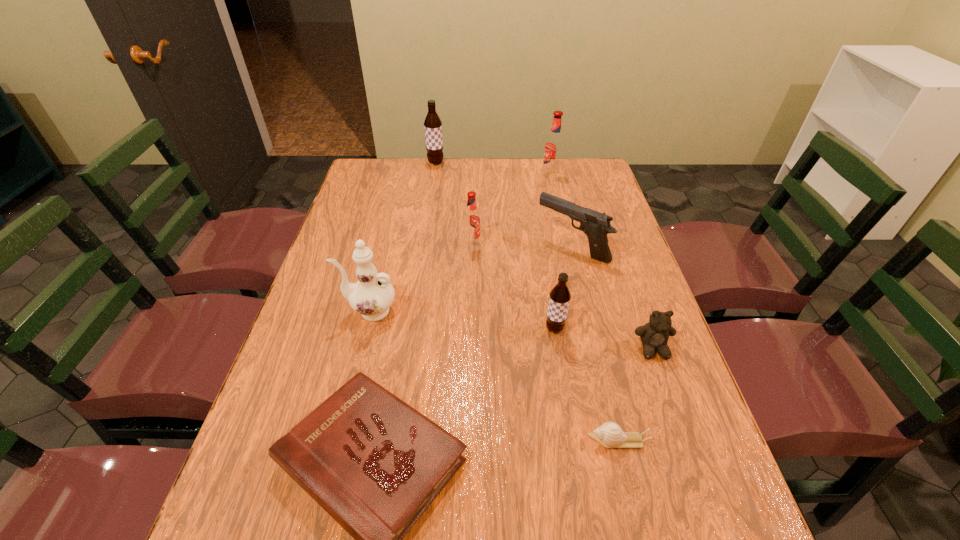
Locate an element on the screen. This screenshot has width=960, height=540. the bigger brown root beer is located at coordinates (433, 126).

At what (x,y) coordinates should I click in order to perform the action: click on the farthest root beer. Please return your answer as a coordinate pair (x, y). The height and width of the screenshot is (540, 960). Looking at the image, I should click on (433, 126).

The height and width of the screenshot is (540, 960). I want to click on the rightmost root beer, so click(554, 145).

This screenshot has width=960, height=540. Identify the location of the right red root beer. (554, 145).

At what (x,y) coordinates should I click in order to perform the action: click on chinaware. Please return your answer as a coordinate pair (x, y). The image size is (960, 540). Looking at the image, I should click on (373, 294).

At what (x,y) coordinates should I click in order to perform the action: click on the nearer red root beer. Please return your answer as a coordinate pair (x, y). Image resolution: width=960 pixels, height=540 pixels. Looking at the image, I should click on (471, 218).

Where is `the third farthest root beer`? the third farthest root beer is located at coordinates tap(471, 218).

This screenshot has height=540, width=960. Find the location of `the smaller brown root beer`. the smaller brown root beer is located at coordinates (559, 297).

The width and height of the screenshot is (960, 540). I want to click on the nearer brown root beer, so click(559, 297).

Locate an element on the screen. gun is located at coordinates (596, 225).